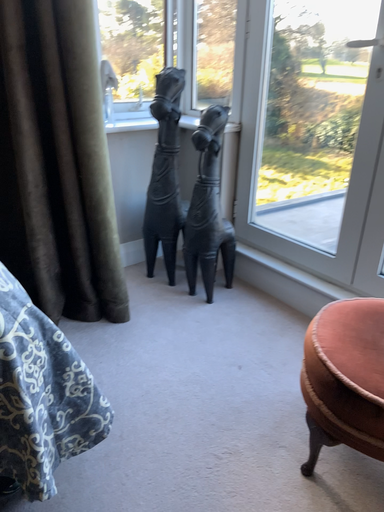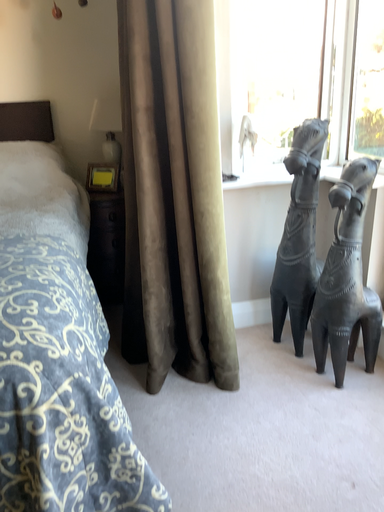
Question: Which way did the camera rotate in the video?

Choices:
 (A) rotated upward
 (B) rotated downward

Answer: (A)